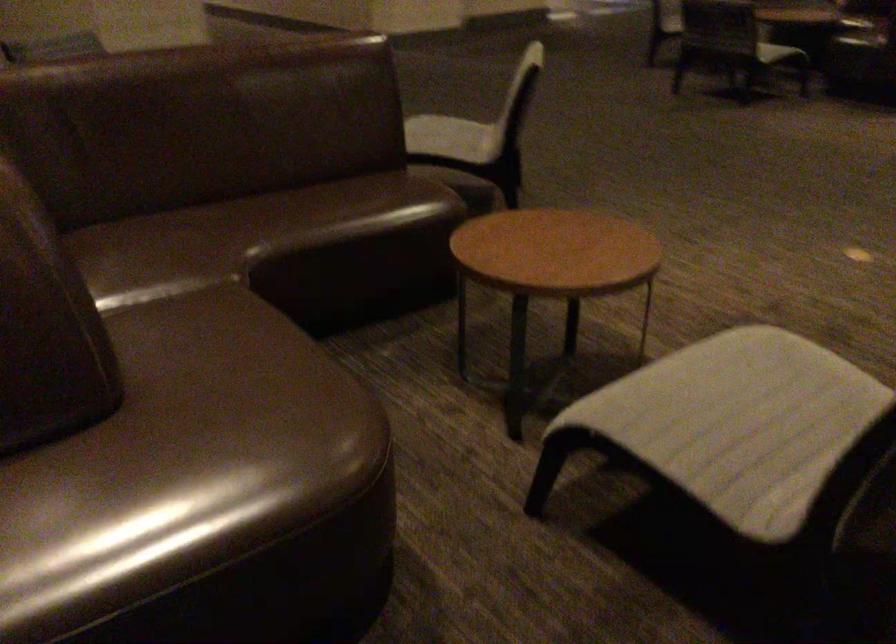
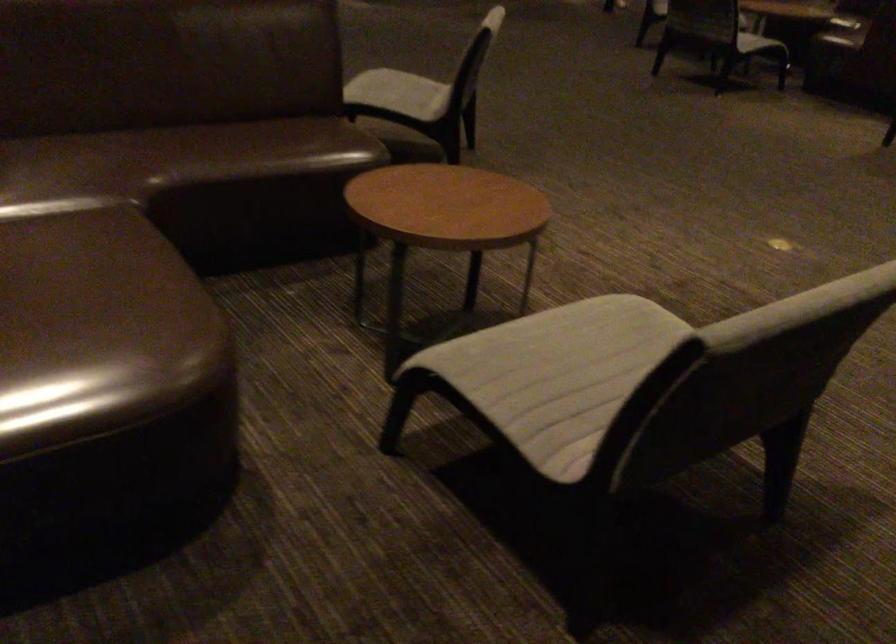
In the second image, find the point that corresponds to (455,140) in the first image.

(399, 93)